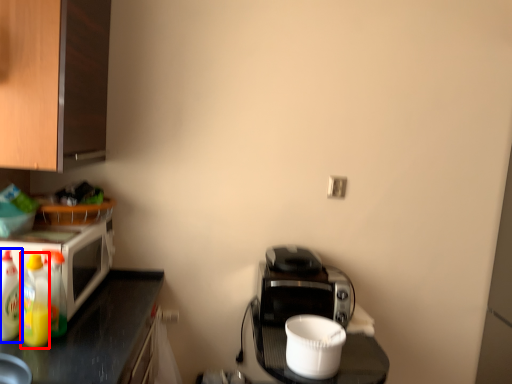
Question: Which object appears closest to the camera in this image, bottle (highlighted by a red box) or bottle (highlighted by a blue box)?

Choices:
 (A) bottle
 (B) bottle

Answer: (A)